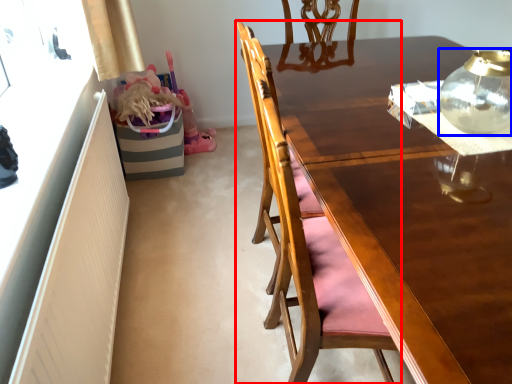
Question: Which object appears closest to the camera in this image, chair (highlighted by a red box) or tea pot (highlighted by a blue box)?

Choices:
 (A) chair
 (B) tea pot

Answer: (B)